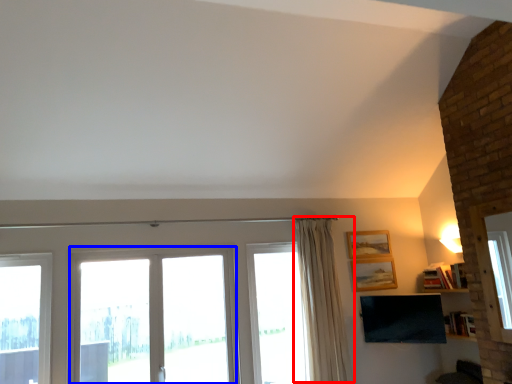
Question: Which of the following is the closest to the observer, curtain (highlighted by a red box) or window (highlighted by a blue box)?

Choices:
 (A) curtain
 (B) window

Answer: (B)